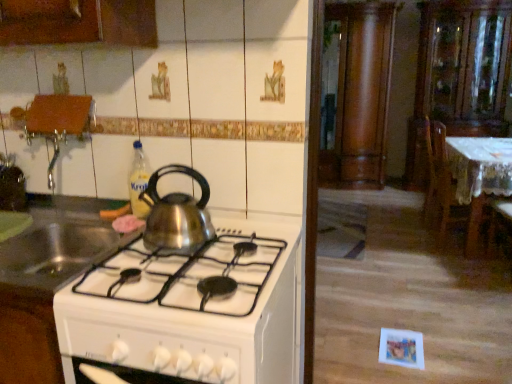
The height and width of the screenshot is (384, 512). What do you see at coordinates (437, 171) in the screenshot?
I see `wooden chair at right` at bounding box center [437, 171].

Locate an element on the screen. The image size is (512, 384). shiny metallic kettle at center, which is the 3th kitchen appliance from left to right is located at coordinates (46, 280).

Measure the distance between white lace tablecloth at right and camera.

9.98 feet.

Image resolution: width=512 pixels, height=384 pixels. Describe the element at coordinates (479, 176) in the screenshot. I see `white lace tablecloth at right` at that location.

Measure the distance between translucent plastic bottle at upper center and camera.

They are 1.50 meters apart.

This screenshot has width=512, height=384. Describe the element at coordinates (177, 215) in the screenshot. I see `satin silver kettle at center, the 2th kitchen appliance viewed from the left` at that location.

What do you see at coordinates (46, 280) in the screenshot?
I see `shiny metallic kettle at center, the 3th kitchen appliance positioned from the right` at bounding box center [46, 280].

I want to click on wooden column at center, marked as the 2th cabinetry in a right-to-left arrangement, so click(355, 93).

Does white lace tablecloth at right lie in front of transparent glass cabinet at upper right, which is the 2th cabinetry in left-to-right order?

Yes.

Between white lace tablecloth at right and transparent glass cabinet at upper right, which is the 2th cabinetry in left-to-right order, which one has less height?

With less height is white lace tablecloth at right.

Is white lace tablecloth at right oriented towards transparent glass cabinet at upper right, which is the 2th cabinetry in left-to-right order?

No, white lace tablecloth at right is not oriented towards transparent glass cabinet at upper right, which is the 2th cabinetry in left-to-right order.

From a real-world perspective, who is located higher, white lace tablecloth at right or transparent glass cabinet at upper right, which is the 2th cabinetry in left-to-right order?

In real-world perspective, transparent glass cabinet at upper right, which is the 2th cabinetry in left-to-right order, is above.

From a real-world perspective, is white lace tablecloth at right physically above satin silver kettle at center, acting as the second kitchen appliance starting from the right?

No, from a real-world perspective, white lace tablecloth at right is not above satin silver kettle at center, acting as the second kitchen appliance starting from the right.

From the image's perspective, is white lace tablecloth at right over satin silver kettle at center, the 2th kitchen appliance viewed from the left?

Yes.

Is white lace tablecloth at right oriented towards satin silver kettle at center, the 2th kitchen appliance viewed from the left?

No.

Locate an element on the screen. the 1st kitchen appliance in front of the white lace tablecloth at right is located at coordinates (177, 215).

Is shiny metallic kettle at center, which is the 3th kitchen appliance from left to right, bigger or smaller than satin silver kettle at center, the 2th kitchen appliance viewed from the left?

shiny metallic kettle at center, which is the 3th kitchen appliance from left to right, is bigger than satin silver kettle at center, the 2th kitchen appliance viewed from the left.

Would you consider shiny metallic kettle at center, which is the 3th kitchen appliance from left to right, to be distant from satin silver kettle at center, acting as the second kitchen appliance starting from the right?

shiny metallic kettle at center, which is the 3th kitchen appliance from left to right, is near satin silver kettle at center, acting as the second kitchen appliance starting from the right, not far away.

Consider the image. From the image's perspective, which one is positioned higher, shiny metallic kettle at center, which is the 3th kitchen appliance from left to right, or satin silver kettle at center, the 2th kitchen appliance viewed from the left?

satin silver kettle at center, the 2th kitchen appliance viewed from the left, appears higher in the image.

How far apart are shiny metallic kettle at center, which appears as the 1th kitchen appliance when viewed from the right, and satin silver kettle at center, acting as the second kitchen appliance starting from the right?

shiny metallic kettle at center, which appears as the 1th kitchen appliance when viewed from the right, and satin silver kettle at center, acting as the second kitchen appliance starting from the right, are 11.84 inches apart.

Considering the sizes of translucent plastic bottle at upper center and transparent glass cabinet at upper right, which is the 2th cabinetry in left-to-right order, in the image, is translucent plastic bottle at upper center bigger or smaller than transparent glass cabinet at upper right, which is the 2th cabinetry in left-to-right order,?

Clearly, translucent plastic bottle at upper center is smaller in size than transparent glass cabinet at upper right, which is the 2th cabinetry in left-to-right order.

Which of these two, translucent plastic bottle at upper center or transparent glass cabinet at upper right, which is the 2th cabinetry in left-to-right order, is thinner?

translucent plastic bottle at upper center.

Is point (58, 352) closer to viewer compared to point (369, 128)?

Yes, point (58, 352) is closer to viewer.

Based on the photo, considering the sizes of objects shiny metallic kettle at center, the 3th kitchen appliance positioned from the right, and wooden column at center, marked as the 2th cabinetry in a right-to-left arrangement, in the image provided, who is bigger, shiny metallic kettle at center, the 3th kitchen appliance positioned from the right, or wooden column at center, marked as the 2th cabinetry in a right-to-left arrangement,?

shiny metallic kettle at center, the 3th kitchen appliance positioned from the right, is bigger.

How distant is shiny metallic kettle at center, the 3th kitchen appliance positioned from the right, from wooden column at center, which is the first cabinetry in left-to-right order?

shiny metallic kettle at center, the 3th kitchen appliance positioned from the right, and wooden column at center, which is the first cabinetry in left-to-right order, are 4.26 meters apart.

Who is taller, shiny metallic kettle at center, the 3th kitchen appliance positioned from the right, or wooden column at center, which is the first cabinetry in left-to-right order?

With more height is wooden column at center, which is the first cabinetry in left-to-right order.

From a real-world perspective, who is located higher, translucent plastic bottle at upper center or wooden column at center, marked as the 2th cabinetry in a right-to-left arrangement?

In real-world perspective, wooden column at center, marked as the 2th cabinetry in a right-to-left arrangement, is above.

Locate an element on the screen. The height and width of the screenshot is (384, 512). the 1st cabinetry to the right when counting from the translucent plastic bottle at upper center is located at coordinates (355, 93).

Do you think translucent plastic bottle at upper center is within wooden column at center, which is the first cabinetry in left-to-right order, or outside of it?

translucent plastic bottle at upper center cannot be found inside wooden column at center, which is the first cabinetry in left-to-right order.

Is shiny metallic kettle at center, the first kitchen appliance in the left-to-right sequence, in contact with satin silver kettle at center, acting as the second kitchen appliance starting from the right?

No, shiny metallic kettle at center, the first kitchen appliance in the left-to-right sequence, is not making contact with satin silver kettle at center, acting as the second kitchen appliance starting from the right.

Who is more distant, shiny metallic kettle at center, the first kitchen appliance in the left-to-right sequence, or satin silver kettle at center, acting as the second kitchen appliance starting from the right?

satin silver kettle at center, acting as the second kitchen appliance starting from the right, is behind.

Is shiny metallic kettle at center, the first kitchen appliance in the left-to-right sequence, at the left side of satin silver kettle at center, the 2th kitchen appliance viewed from the left?

Yes, shiny metallic kettle at center, the first kitchen appliance in the left-to-right sequence, is to the left of satin silver kettle at center, the 2th kitchen appliance viewed from the left.

Is shiny metallic kettle at center, the first kitchen appliance in the left-to-right sequence, not within satin silver kettle at center, the 2th kitchen appliance viewed from the left?

shiny metallic kettle at center, the first kitchen appliance in the left-to-right sequence, lies outside satin silver kettle at center, the 2th kitchen appliance viewed from the left,'s area.

The height and width of the screenshot is (384, 512). Find the location of `the 1st cabinetry positioned above the white lace tablecloth at right (from the image's perspective)`. the 1st cabinetry positioned above the white lace tablecloth at right (from the image's perspective) is located at coordinates (459, 74).

Find the location of a particular element. The height and width of the screenshot is (384, 512). the 3rd kitchen appliance located above the white lace tablecloth at right (from a real-world perspective) is located at coordinates (177, 215).

Based on their spatial positions, is wooden chair at right or wooden column at center, marked as the 2th cabinetry in a right-to-left arrangement, further from white lace tablecloth at right?

wooden column at center, marked as the 2th cabinetry in a right-to-left arrangement.

Considering their positions, is shiny metallic kettle at center, the first kitchen appliance in the left-to-right sequence, positioned further to shiny metallic kettle at center, which is the 3th kitchen appliance from left to right, than translucent plastic bottle at upper center?

translucent plastic bottle at upper center is positioned further to the anchor shiny metallic kettle at center, which is the 3th kitchen appliance from left to right.

Based on their spatial positions, is shiny metallic kettle at center, the first kitchen appliance in the left-to-right sequence, or wooden column at center, which is the first cabinetry in left-to-right order, further from satin silver kettle at center, acting as the second kitchen appliance starting from the right?

wooden column at center, which is the first cabinetry in left-to-right order, is positioned further to the anchor satin silver kettle at center, acting as the second kitchen appliance starting from the right.

Estimate the real-world distances between objects in this image. Which object is closer to shiny metallic kettle at center, the first kitchen appliance in the left-to-right sequence, translucent plastic bottle at upper center or wooden chair at right?

Based on the image, translucent plastic bottle at upper center appears to be nearer to shiny metallic kettle at center, the first kitchen appliance in the left-to-right sequence.

Looking at the image, which one is located further to wooden column at center, marked as the 2th cabinetry in a right-to-left arrangement, white lace tablecloth at right or shiny metallic kettle at center, the first kitchen appliance in the left-to-right sequence?

shiny metallic kettle at center, the first kitchen appliance in the left-to-right sequence, lies further to wooden column at center, marked as the 2th cabinetry in a right-to-left arrangement, than the other object.

When comparing their distances from shiny metallic kettle at center, the 3th kitchen appliance positioned from the right, does satin silver kettle at center, acting as the second kitchen appliance starting from the right, or wooden chair at right seem further?

Based on the image, wooden chair at right appears to be further to shiny metallic kettle at center, the 3th kitchen appliance positioned from the right.

Estimate the real-world distances between objects in this image. Which object is closer to shiny metallic kettle at center, which appears as the 1th kitchen appliance when viewed from the right, satin silver kettle at center, the 2th kitchen appliance viewed from the left, or wooden chair at right?

Among the two, satin silver kettle at center, the 2th kitchen appliance viewed from the left, is located nearer to shiny metallic kettle at center, which appears as the 1th kitchen appliance when viewed from the right.

Estimate the real-world distances between objects in this image. Which object is further from translucent plastic bottle at upper center, satin silver kettle at center, acting as the second kitchen appliance starting from the right, or transparent glass cabinet at upper right, which is the 2th cabinetry in left-to-right order?

transparent glass cabinet at upper right, which is the 2th cabinetry in left-to-right order, is further to translucent plastic bottle at upper center.

Image resolution: width=512 pixels, height=384 pixels. I want to click on bottle located between shiny metallic kettle at center, the 3th kitchen appliance positioned from the right, and wooden column at center, marked as the 2th cabinetry in a right-to-left arrangement, in the depth direction, so click(139, 181).

At what (x,y) coordinates should I click in order to perform the action: click on bottle situated between shiny metallic kettle at center, the 3th kitchen appliance positioned from the right, and white lace tablecloth at right from left to right. Please return your answer as a coordinate pair (x, y). Looking at the image, I should click on (139, 181).

You are a GUI agent. You are given a task and a screenshot of the screen. Output one action in this format:
    pyautogui.click(x=<x>, y=<y>)
    Task: Click on the table between satin silver kettle at center, acting as the second kitchen appliance starting from the right, and transparent glass cabinet at upper right, which is the first cabinetry from right to left, along the z-axis
    The height and width of the screenshot is (384, 512).
    Given the screenshot: What is the action you would take?
    pyautogui.click(x=479, y=176)

Identify the location of kitchen appliance between shiny metallic kettle at center, the first kitchen appliance in the left-to-right sequence, and shiny metallic kettle at center, which is the 3th kitchen appliance from left to right, from left to right. (177, 215).